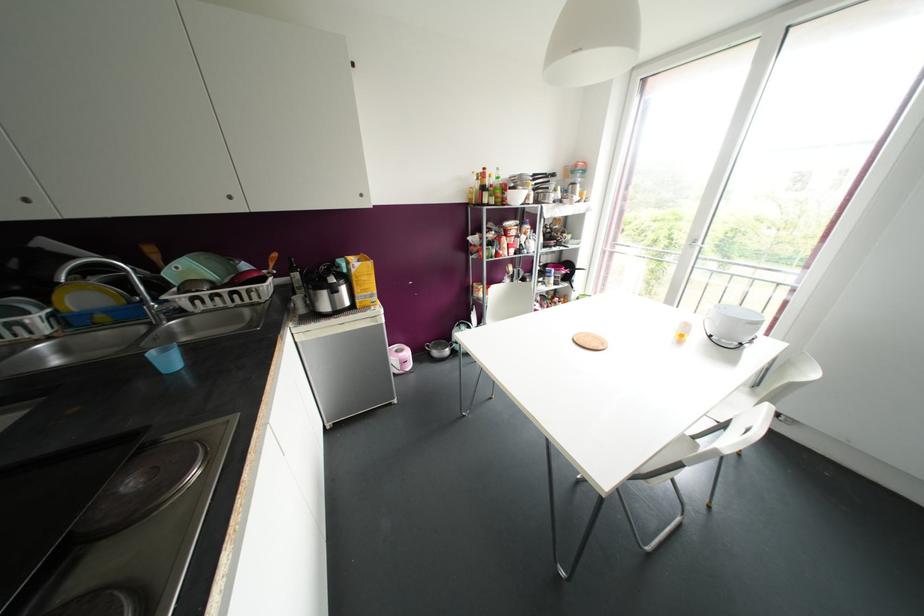
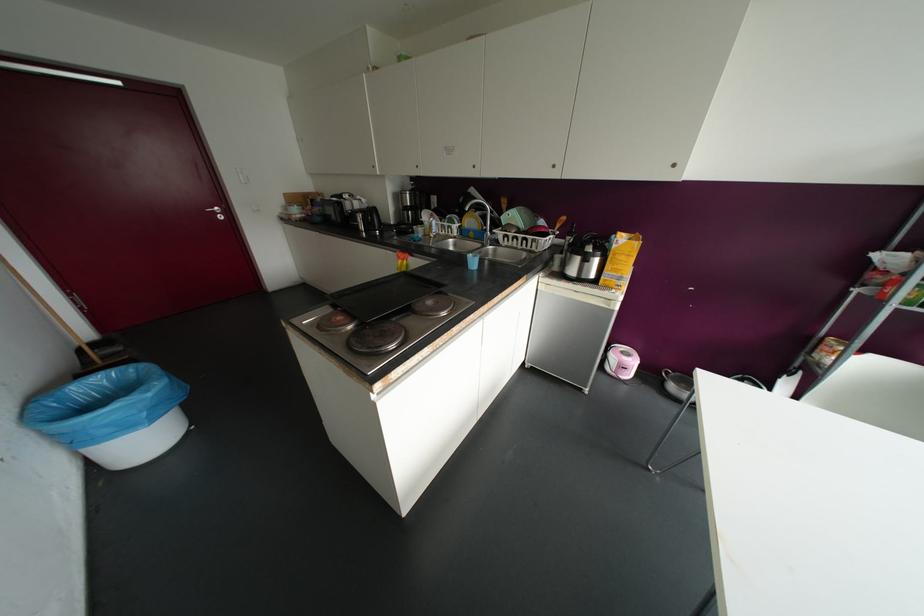
Find the pixel in the second image that matches (360,195) in the first image.

(673, 164)